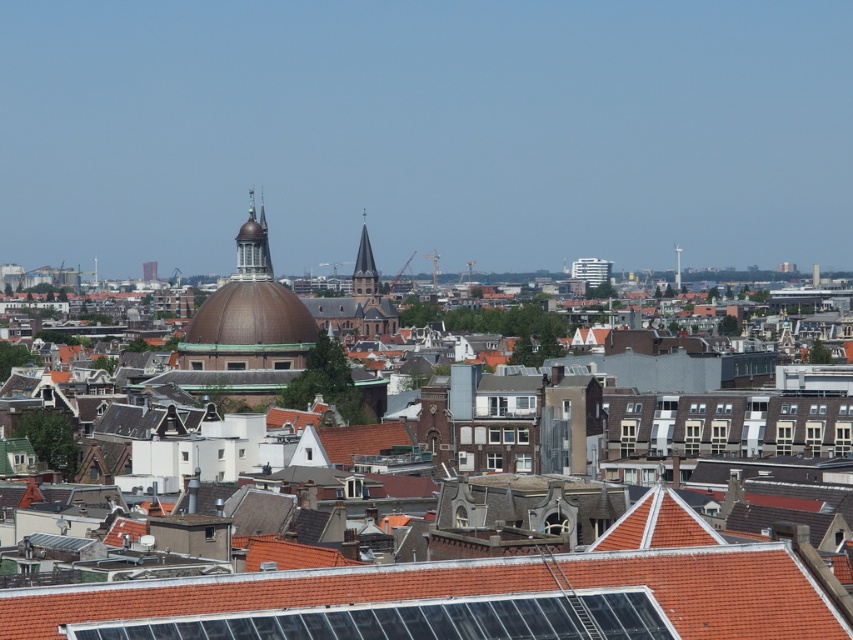
Which of these two, red tile roof at center or brown copper dome at center, stands shorter?

Standing shorter between the two is red tile roof at center.

Measure the distance between red tile roof at center and brown copper dome at center.

They are 686.55 feet apart.

Where is `red tile roof at center`? red tile roof at center is located at coordinates (454, 600).